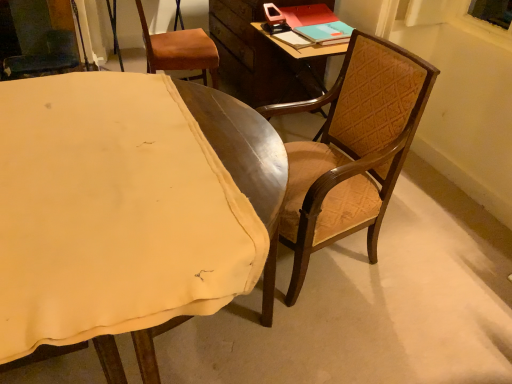
You are a GUI agent. You are given a task and a screenshot of the screen. Output one action in this format:
    pyautogui.click(x=<x>, y=<y>)
    Task: Click on the free space on the front side of wooden chair at center, positioned as the second chair in front-to-back order
    The image size is (512, 384).
    Given the screenshot: What is the action you would take?
    pyautogui.click(x=357, y=333)